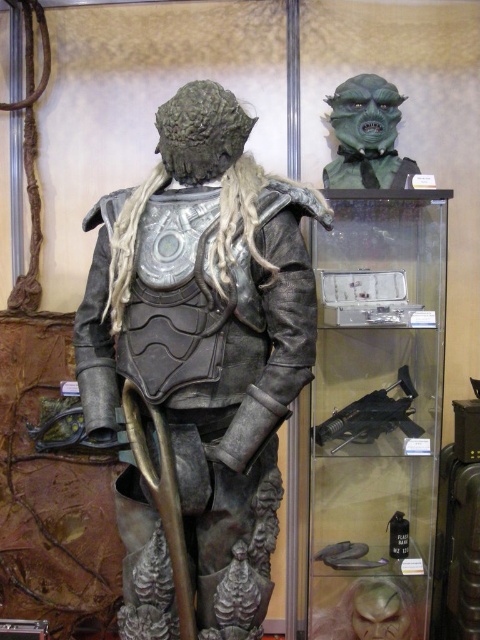
Is bronze armor at center behind green matte mask at upper center?

No.

Is bronze armor at center to the left of green matte mask at upper center from the viewer's perspective?

Indeed, bronze armor at center is positioned on the left side of green matte mask at upper center.

Who is more distant from viewer, (241, 250) or (337, 150)?

Point (337, 150)

This screenshot has width=480, height=640. I want to click on bronze armor at center, so click(206, 337).